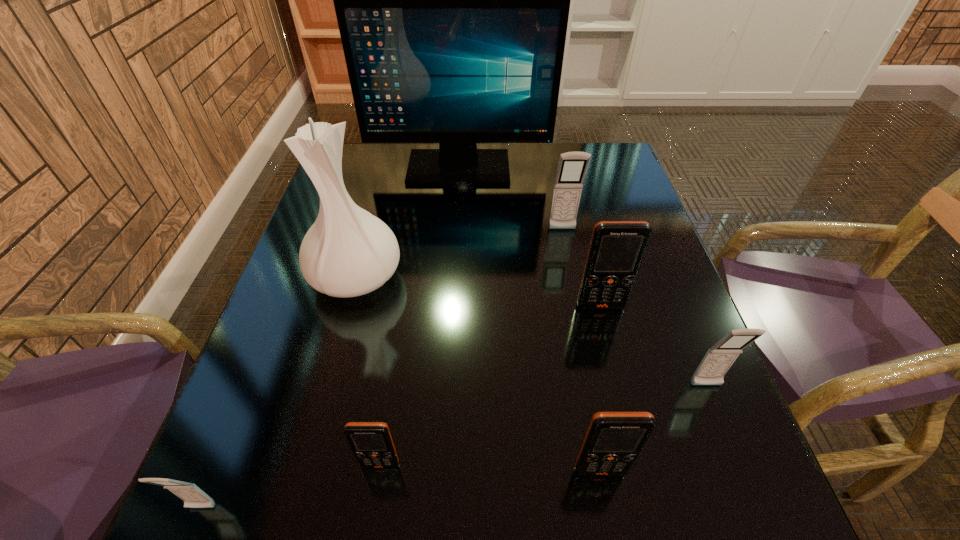
You are a GUI agent. You are given a task and a screenshot of the screen. Output one action in this format:
    pyautogui.click(x=<x>, y=<y>)
    Task: Click on the blank area at the right edge
    The height and width of the screenshot is (540, 960).
    Given the screenshot: What is the action you would take?
    pyautogui.click(x=663, y=407)

Locate an element on the screen. vacant space at the far left corner of the desktop is located at coordinates (374, 150).

The image size is (960, 540). Find the location of `free space at the near left corner of the desktop`. free space at the near left corner of the desktop is located at coordinates (270, 523).

Locate an element on the screen. This screenshot has width=960, height=540. free space at the far right corner of the desktop is located at coordinates (600, 177).

Where is `vacant space at the near right corner of the desktop`? The image size is (960, 540). vacant space at the near right corner of the desktop is located at coordinates (708, 531).

You are a GUI agent. You are given a task and a screenshot of the screen. Output one action in this format:
    pyautogui.click(x=<x>, y=<y>)
    Task: Click on the vacant area that lies between the leftmost orange cellular telephone and the biggest gray cellular telephone
    
    Given the screenshot: What is the action you would take?
    pyautogui.click(x=471, y=347)

Find the location of a particular element. This screenshot has height=540, width=960. free space between the monitor and the second cellular telephone from left to right is located at coordinates (420, 316).

In order to click on vacant space that's between the second farthest object and the nearest gray cellular telephone in this screenshot , I will do `click(381, 369)`.

Find the location of a particular element. vacant area between the rightmost object and the second tallest object is located at coordinates (531, 332).

The width and height of the screenshot is (960, 540). I want to click on vacant area that lies between the tallest object and the leftmost orange cellular telephone, so click(420, 316).